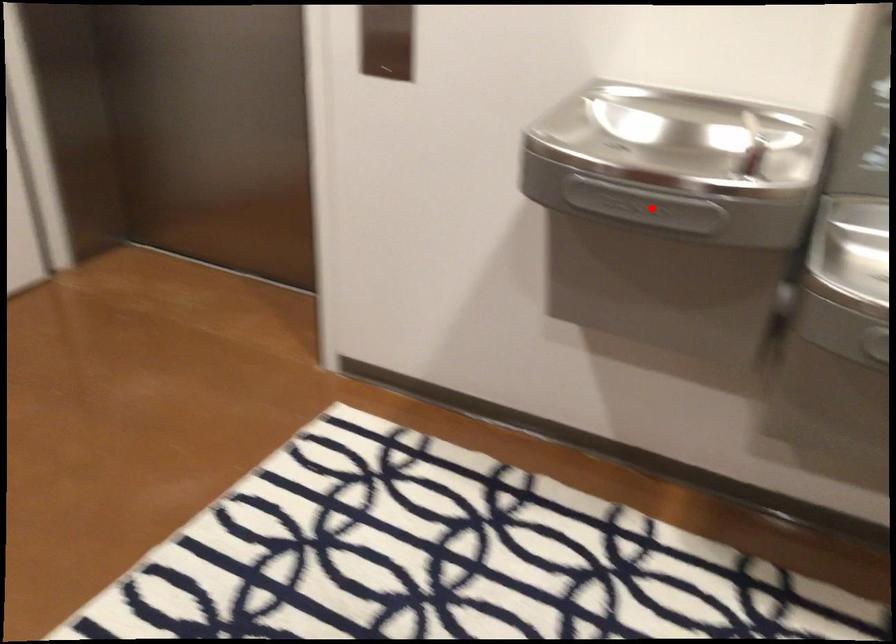
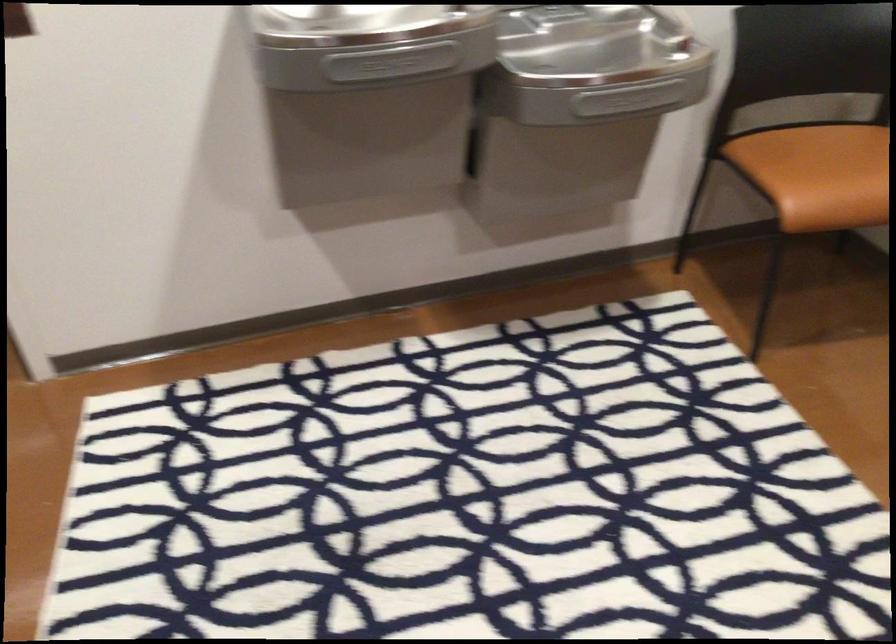
Question: I am providing you with two images of the same scene from different viewpoints. In image1, a red point is highlighted. Considering the same 3D point in image2, which of the following is correct?

Choices:
 (A) It is closer
 (B) It is farther

Answer: (B)